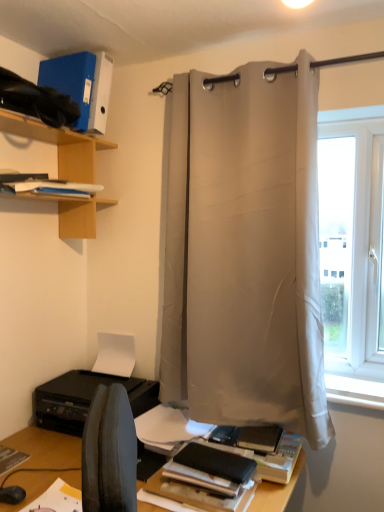
Question: Is white matte paper at lower center positioned behind white smooth window sill at lower right?

Choices:
 (A) yes
 (B) no

Answer: (A)

Question: Is white matte paper at lower center positioned with its back to white smooth window sill at lower right?

Choices:
 (A) no
 (B) yes

Answer: (A)

Question: From the image's perspective, is white matte paper at lower center above white smooth window sill at lower right?

Choices:
 (A) no
 (B) yes

Answer: (B)

Question: From a real-world perspective, is white matte paper at lower center over white smooth window sill at lower right?

Choices:
 (A) yes
 (B) no

Answer: (A)

Question: Can you confirm if white matte paper at lower center is wider than white smooth window sill at lower right?

Choices:
 (A) yes
 (B) no

Answer: (B)

Question: Considering the positions of black matte printer at lower left and matte black book at lower center, which is counted as the first paperback book, starting from the bottom, in the image, is black matte printer at lower left taller or shorter than matte black book at lower center, which is counted as the first paperback book, starting from the bottom,?

Choices:
 (A) tall
 (B) short

Answer: (A)

Question: From a real-world perspective, is black matte printer at lower left positioned above or below matte black book at lower center, which is the second paperback book from left to right?

Choices:
 (A) above
 (B) below

Answer: (A)

Question: In the image, is black matte printer at lower left positioned in front of or behind matte black book at lower center, marked as the 1th paperback book in a right-to-left arrangement?

Choices:
 (A) behind
 (B) front

Answer: (A)

Question: Considering the positions of point (49, 420) and point (221, 495), is point (49, 420) closer or farther from the camera than point (221, 495)?

Choices:
 (A) closer
 (B) farther

Answer: (B)

Question: Would you say white fabric curtain at center is inside or outside black matte printer at lower left?

Choices:
 (A) inside
 (B) outside

Answer: (B)

Question: Is white fabric curtain at center wider or thinner than black matte printer at lower left?

Choices:
 (A) thin
 (B) wide

Answer: (A)

Question: In terms of height, does white fabric curtain at center look taller or shorter compared to black matte printer at lower left?

Choices:
 (A) short
 (B) tall

Answer: (B)

Question: Is white fabric curtain at center in front of or behind black matte printer at lower left in the image?

Choices:
 (A) behind
 (B) front

Answer: (B)

Question: Would you say black matte printer at lower left is to the left or to the right of white smooth window sill at lower right in the picture?

Choices:
 (A) left
 (B) right

Answer: (A)

Question: Considering the positions of black matte printer at lower left and white smooth window sill at lower right in the image, is black matte printer at lower left taller or shorter than white smooth window sill at lower right?

Choices:
 (A) short
 (B) tall

Answer: (B)